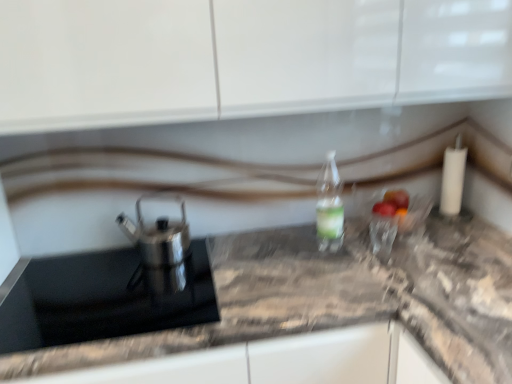
Locate an element on the screen. Image resolution: width=512 pixels, height=384 pixels. vacant space in front of satin silver teapot at left is located at coordinates (130, 300).